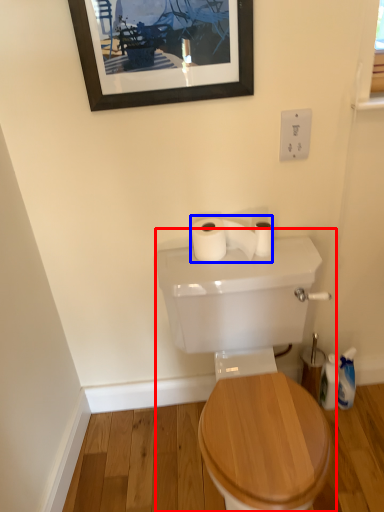
Question: Which object is further to the camera taking this photo, sink (highlighted by a red box) or toilet paper (highlighted by a blue box)?

Choices:
 (A) sink
 (B) toilet paper

Answer: (B)